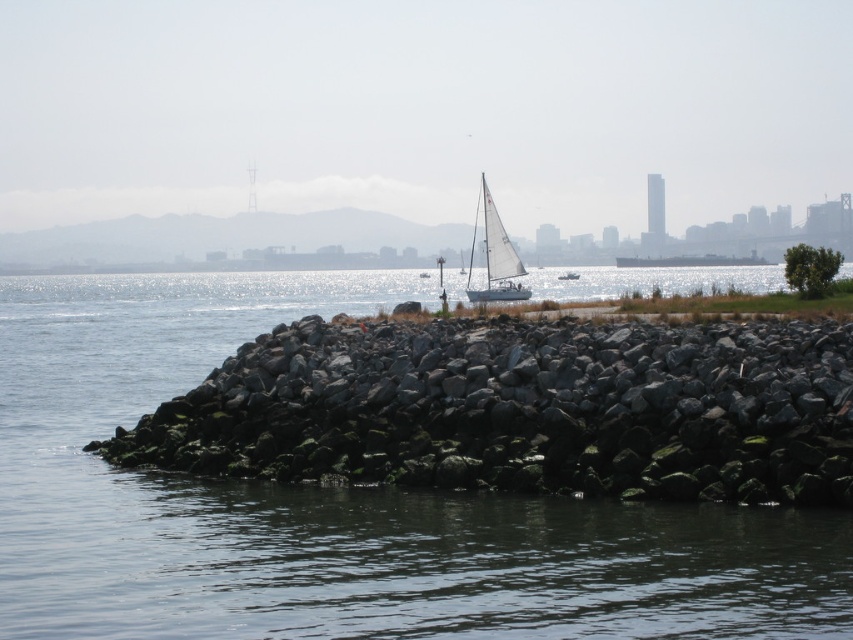
You are a photographer trying to capture the sailboat in the image. The sailboat is located at position point A. Where should you position your camera to ensure the smooth gray water at center is visible in the frame?

The smooth gray water at center is located at point A, so positioning the camera at point A will ensure it is visible in the frame.

You are standing on the shore looking at the gray rock at center and the white sailboat at center. Which object appears larger in the scene?

The white sailboat at center appears larger than the gray rock at center because the gray rock at center has a smaller size compared to the white sailboat at center.